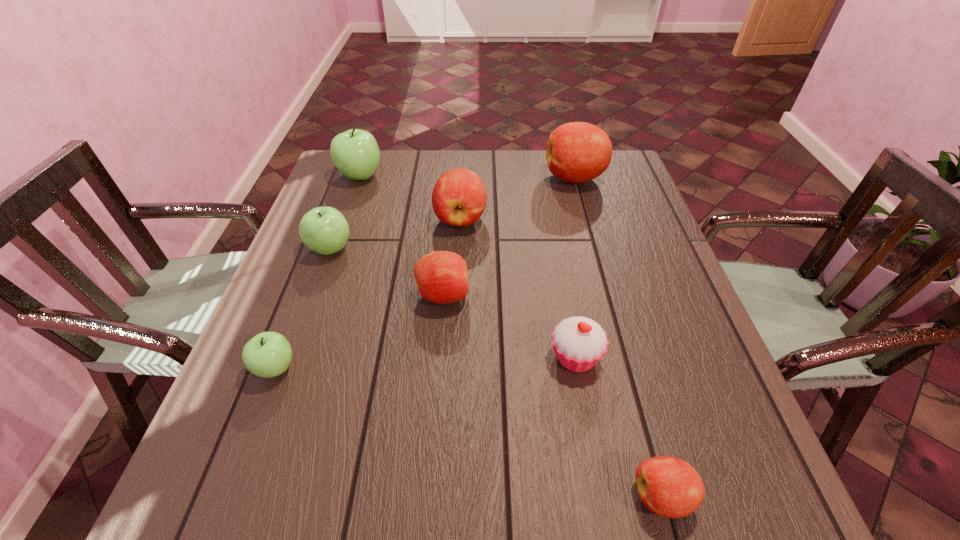
Identify the location of object that is positioned at the far left corner. (355, 153).

Locate an element on the screen. object at the far right corner is located at coordinates (576, 152).

I want to click on object present at the near right corner, so click(668, 486).

The image size is (960, 540). In the image, there is a desktop. What are the coordinates of `free region at the far edge` in the screenshot? It's located at (496, 165).

Where is `vacant space at the near edge of the desktop`? The image size is (960, 540). vacant space at the near edge of the desktop is located at coordinates (609, 472).

The width and height of the screenshot is (960, 540). What are the coordinates of `vacant region at the left edge of the desktop` in the screenshot? It's located at (365, 211).

Identify the location of vacant space at the right edge. The height and width of the screenshot is (540, 960). (637, 294).

This screenshot has height=540, width=960. In the image, there is a desktop. Find the location of `vacant space at the far left corner`. vacant space at the far left corner is located at coordinates (321, 190).

Find the location of a particular element. The image size is (960, 540). blank space at the near left corner of the desktop is located at coordinates (217, 471).

In the image, there is a desktop. What are the coordinates of `vacant space at the far right corner` in the screenshot? It's located at (617, 170).